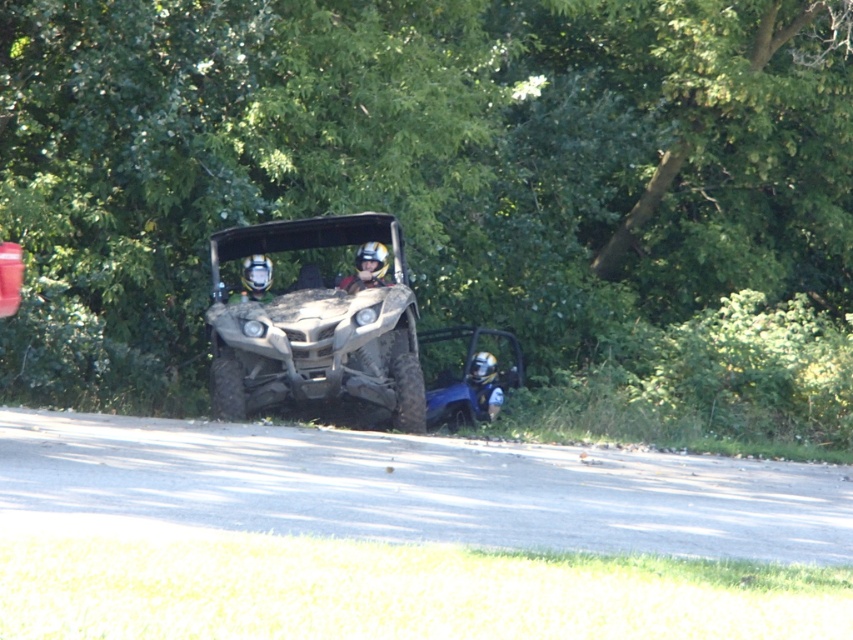
You are a photographer standing at the edge of the paved road. You want to take a photo of the green leafy tree at center and the matte yellow helmet at center. Which object should you focus on first if you want to capture both in the same frame without moving your camera?

The green leafy tree at center is taller than the matte yellow helmet at center, so you should focus on the green leafy tree at center first to ensure it fits within the frame.

You are standing at the starting point of the paved road in the image. You want to reach the green leafy tree at center. Which direction should you head towards?

The green leafy tree at center is located at point coordinates of [415,163]. Since you are at the starting point of the paved road, you should head towards the center of the image to reach the green leafy tree at center.